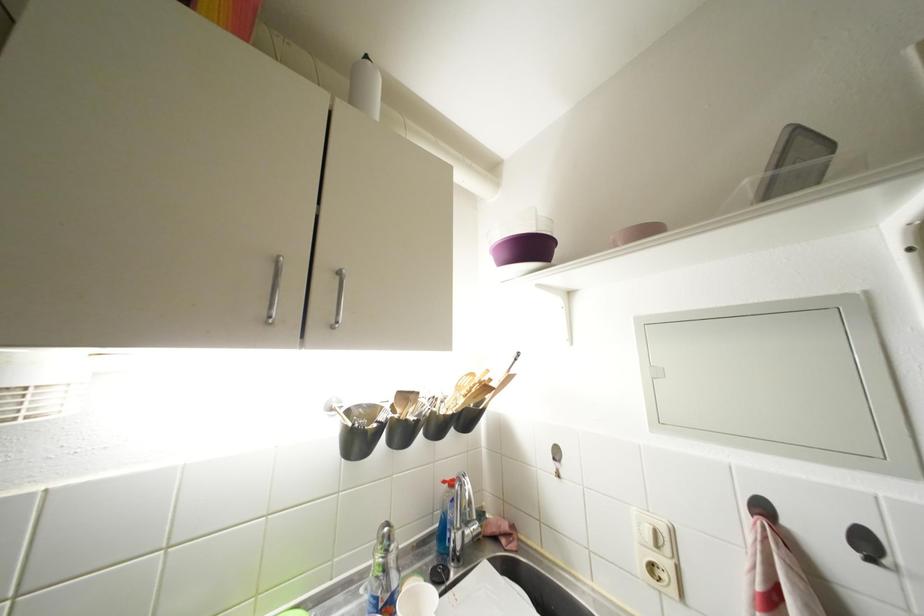
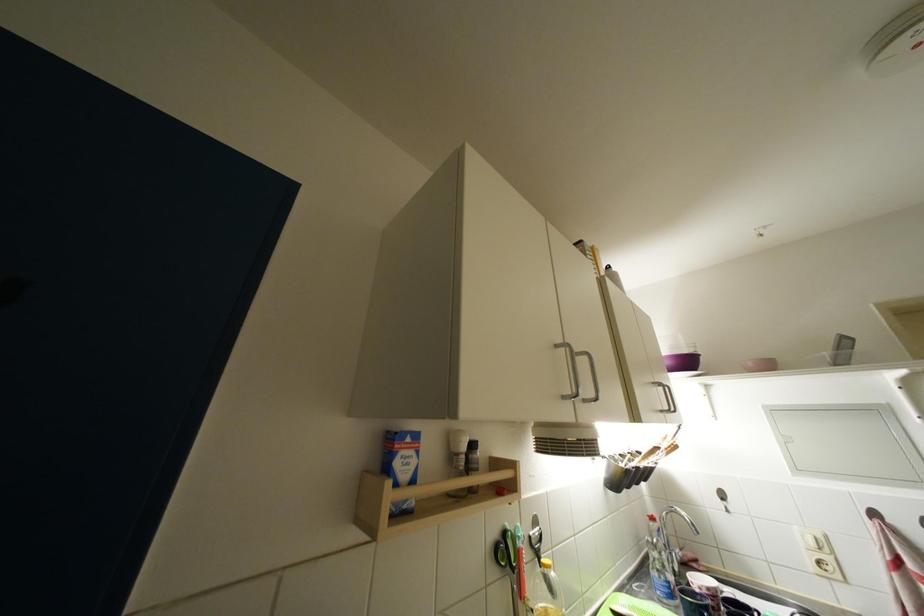
In the second image, find the point that corresponds to [512,259] in the first image.

(675, 367)